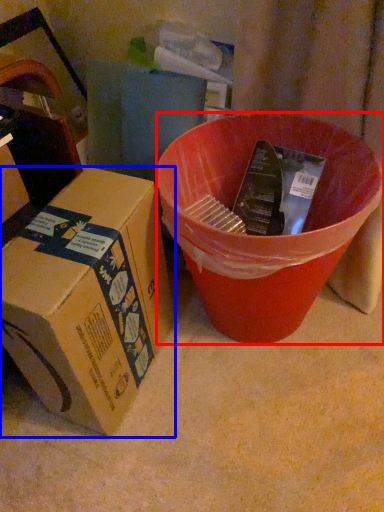
Question: Which object appears farthest to the camera in this image, bucket (highlighted by a red box) or box (highlighted by a blue box)?

Choices:
 (A) bucket
 (B) box

Answer: (A)